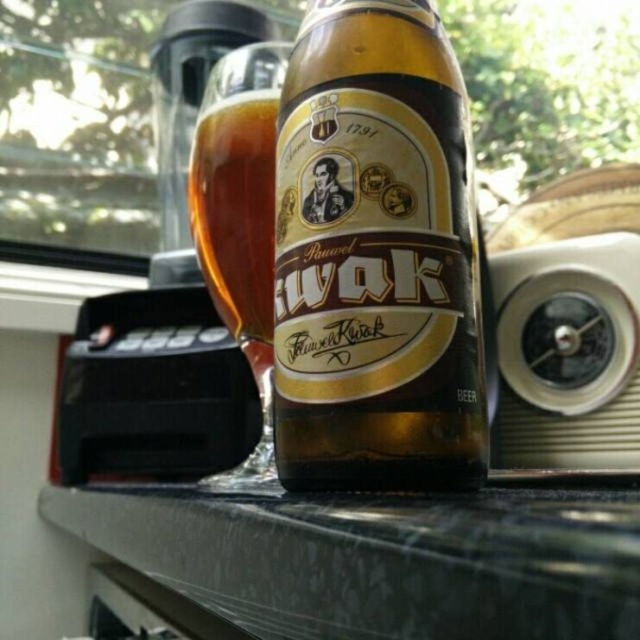
Can you confirm if black marble counter at center is positioned above amber glass mug at upper center?

Incorrect, black marble counter at center is not positioned above amber glass mug at upper center.

Does point (237, 616) come behind point (234, 216)?

No, (237, 616) is closer to viewer.

Where is `black marble counter at center`? black marble counter at center is located at coordinates click(x=378, y=557).

Which of these two, brown glass beer bottle at center or black marble counter at center, stands shorter?

Standing shorter between the two is black marble counter at center.

Who is more forward, (323, 288) or (275, 566)?

Point (275, 566)

This screenshot has width=640, height=640. I want to click on brown glass beer bottle at center, so click(x=376, y=257).

Can you confirm if brown glass beer bottle at center is shorter than amber glass mug at upper center?

No, brown glass beer bottle at center is not shorter than amber glass mug at upper center.

You are a GUI agent. You are given a task and a screenshot of the screen. Output one action in this format:
    pyautogui.click(x=<x>, y=<y>)
    Task: Click on the brown glass beer bottle at center
    This screenshot has height=640, width=640.
    Given the screenshot: What is the action you would take?
    pyautogui.click(x=376, y=257)

What do you see at coordinates (376, 257) in the screenshot?
I see `brown glass beer bottle at center` at bounding box center [376, 257].

This screenshot has height=640, width=640. Find the location of `brown glass beer bottle at center`. brown glass beer bottle at center is located at coordinates (376, 257).